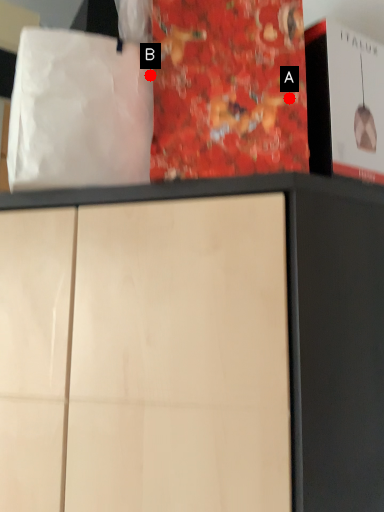
Question: Two points are circled on the image, labeled by A and B beside each circle. Which of the following is the closest to the observer?

Choices:
 (A) A is closer
 (B) B is closer

Answer: (A)